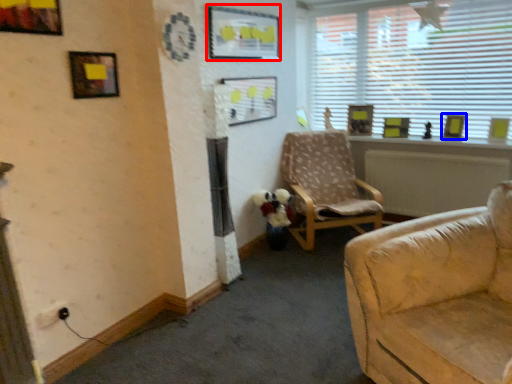
Question: Which of the following is the closest to the observer, picture frame (highlighted by a red box) or picture frame (highlighted by a blue box)?

Choices:
 (A) picture frame
 (B) picture frame

Answer: (A)